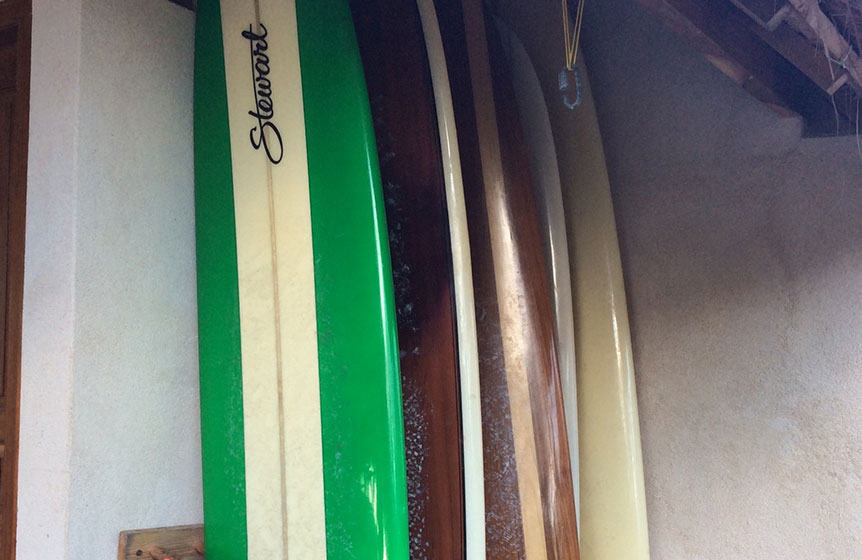
The height and width of the screenshot is (560, 862). I want to click on rack, so click(x=182, y=536).